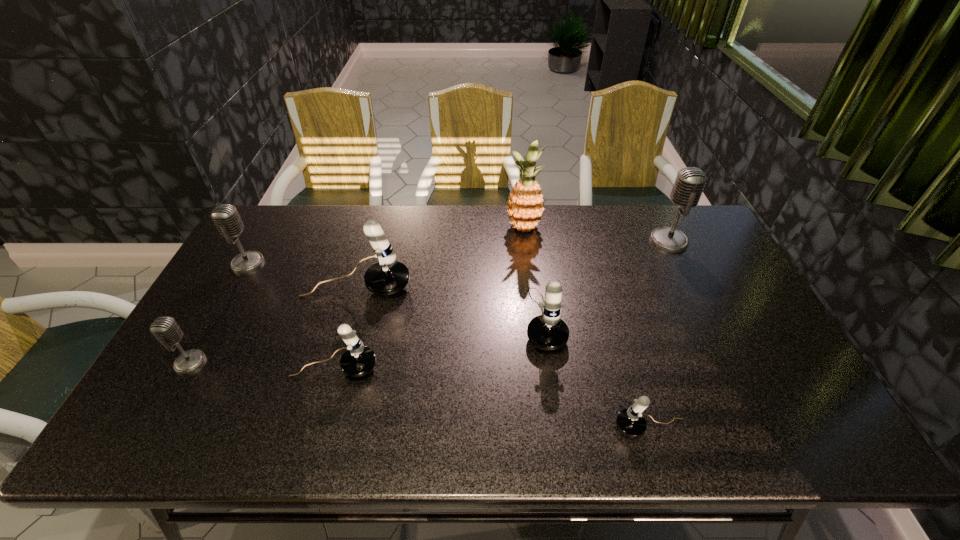
The width and height of the screenshot is (960, 540). Identify the location of vacant space that's between the smallest gray microphone and the pineapple. (357, 295).

The width and height of the screenshot is (960, 540). Identify the location of free space between the second smallest white microphone and the pineapple. (429, 298).

At what (x,y) coordinates should I click in order to perform the action: click on empty location between the tallest object and the second biggest white microphone. Please return your answer as a coordinate pair (x, y). Looking at the image, I should click on (534, 273).

Locate an element on the screen. This screenshot has height=540, width=960. free area in between the farthest microphone and the biggest white microphone is located at coordinates (513, 264).

Image resolution: width=960 pixels, height=540 pixels. Find the location of `free space that is in between the rightmost microphone and the biggest white microphone`. free space that is in between the rightmost microphone and the biggest white microphone is located at coordinates (513, 264).

This screenshot has width=960, height=540. I want to click on free area in between the rightmost object and the third biggest white microphone, so click(502, 304).

I want to click on object that is the seventh closest to the shortest object, so click(x=225, y=216).

Where is `object that is the third nearest to the third biggest white microphone`? The height and width of the screenshot is (540, 960). object that is the third nearest to the third biggest white microphone is located at coordinates (225, 216).

The width and height of the screenshot is (960, 540). What are the coordinates of `the second closest microphone relative to the smallest white microphone` in the screenshot? It's located at (358, 360).

The image size is (960, 540). In order to click on microphone identified as the sixth closest to the nearest gray microphone in this screenshot , I will do `click(690, 182)`.